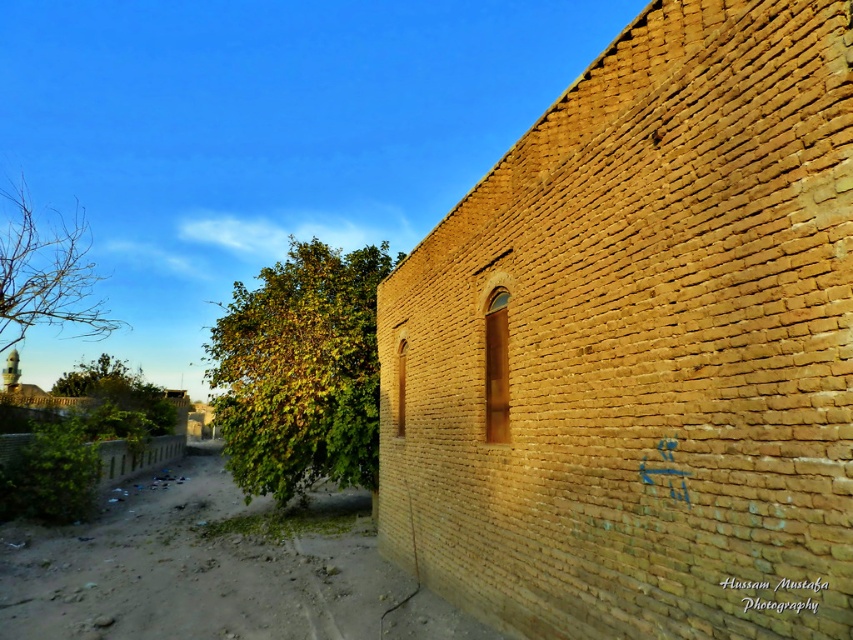
Question: Observing the image, what is the correct spatial positioning of yellow brick wall at right in reference to brown wooden window at center?

Choices:
 (A) left
 (B) right

Answer: (A)

Question: Which object is farther from the camera taking this photo?

Choices:
 (A) dirt ground at lower left
 (B) yellow brick wall at right
 (C) matte glass window at center

Answer: (C)

Question: Estimate the real-world distances between objects in this image. Which object is farther from the matte glass window at center?

Choices:
 (A) green leafy tree at lower left
 (B) yellow brick wall at right
 (C) brown wooden window at center
 (D) dirt ground at lower left

Answer: (A)

Question: Estimate the real-world distances between objects in this image. Which object is closer to the matte glass window at center?

Choices:
 (A) dirt ground at lower left
 (B) yellow brick wall at right
 (C) bare branches at upper left

Answer: (B)

Question: Does yellow brick wall at right have a smaller size compared to matte glass window at center?

Choices:
 (A) yes
 (B) no

Answer: (B)

Question: Can you confirm if yellow brick wall at right is wider than dirt ground at lower left?

Choices:
 (A) no
 (B) yes

Answer: (A)